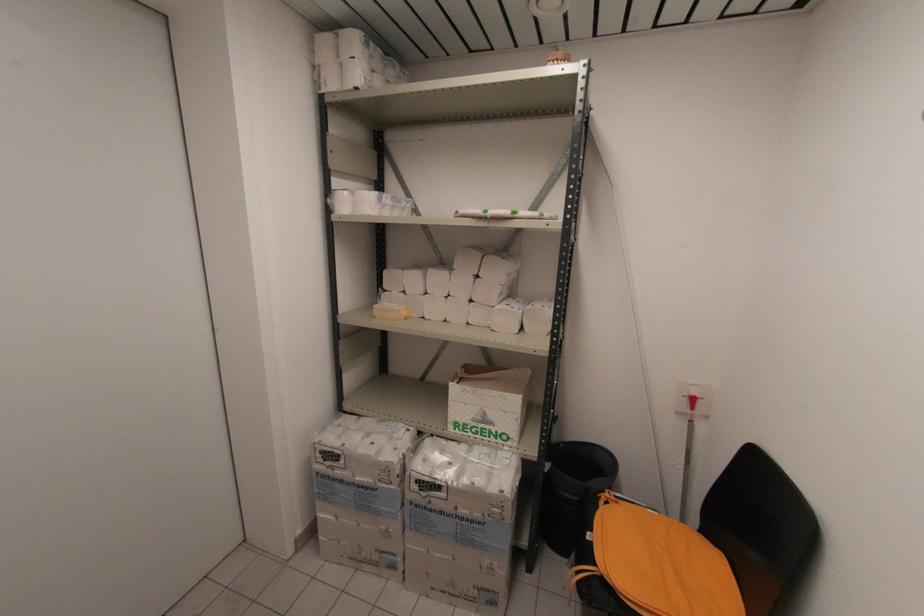
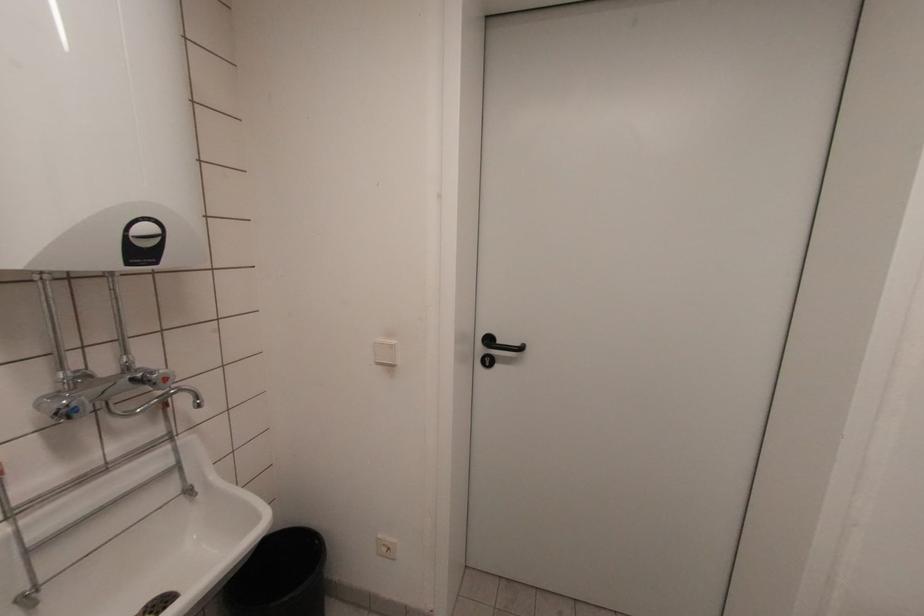
Question: How did the camera likely rotate?

Choices:
 (A) Left
 (B) Right
 (C) Up
 (D) Down

Answer: (A)